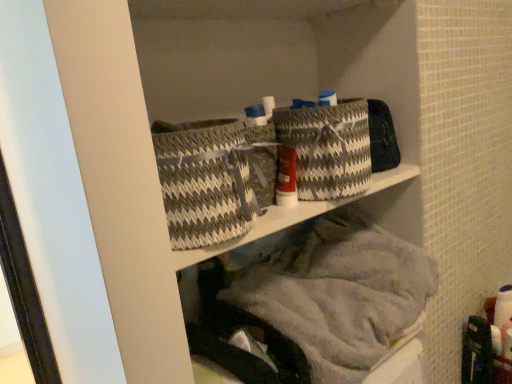
Describe the element at coordinates (337, 291) in the screenshot. Image resolution: width=512 pixels, height=384 pixels. I see `gray woven baskets at upper center` at that location.

In order to face gray and white woven basket at center, which is the first basket from right to left, should I rotate leftwards or rightwards?

You should look right and rotate roughly 9.445 degrees.

The height and width of the screenshot is (384, 512). Describe the element at coordinates (205, 181) in the screenshot. I see `gray woven basket at center, the second basket positioned from the right` at that location.

Where is `gray woven baskets at upper center`? This screenshot has height=384, width=512. gray woven baskets at upper center is located at coordinates (337, 291).

Where is `toiletry that appears above the gray woven baskets at upper center (from the image's perspective)`? toiletry that appears above the gray woven baskets at upper center (from the image's perspective) is located at coordinates (x=286, y=177).

Is gray woven baskets at upper center positioned beyond the bounds of white plastic can at center?

Absolutely, gray woven baskets at upper center is external to white plastic can at center.

Is gray woven baskets at upper center far away from gray woven basket at center, the first basket positioned from the left?

No, there isn't a large distance between gray woven baskets at upper center and gray woven basket at center, the first basket positioned from the left.

Is gray woven baskets at upper center shorter than gray woven basket at center, the second basket positioned from the right?

No.

Considering the relative sizes of gray woven baskets at upper center and gray woven basket at center, the second basket positioned from the right, in the image provided, is gray woven baskets at upper center bigger than gray woven basket at center, the second basket positioned from the right,?

Correct, gray woven baskets at upper center is larger in size than gray woven basket at center, the second basket positioned from the right.

Which is behind, point (298, 258) or point (188, 147)?

Point (298, 258)

In the scene shown: Could you tell me if white plastic can at center is facing gray woven basket at center, the second basket positioned from the right?

No, white plastic can at center is not turned towards gray woven basket at center, the second basket positioned from the right.

Is white plastic can at center wider or thinner than gray woven basket at center, the first basket positioned from the left?

In the image, white plastic can at center appears to be more narrow than gray woven basket at center, the first basket positioned from the left.

Is white plastic can at center shorter than gray woven basket at center, the first basket positioned from the left?

Yes.

Who is smaller, white plastic can at center or gray woven basket at center, the second basket positioned from the right?

Smaller between the two is white plastic can at center.

Considering the positions of objects white plastic can at center and gray woven baskets at upper center in the image provided, who is more to the right, white plastic can at center or gray woven baskets at upper center?

gray woven baskets at upper center is more to the right.

This screenshot has height=384, width=512. Find the location of `material on the right of the white plastic can at center`. material on the right of the white plastic can at center is located at coordinates (337, 291).

Considering the points (281, 189) and (379, 357), which point is behind, point (281, 189) or point (379, 357)?

Positioned behind is point (379, 357).

Considering the points (190, 122) and (285, 172), which point is behind, point (190, 122) or point (285, 172)?

The point (190, 122) is farther from the camera.

Is gray woven basket at center, the second basket positioned from the right, beside white plastic can at center?

gray woven basket at center, the second basket positioned from the right, and white plastic can at center are not in contact.

From a real-world perspective, is gray woven basket at center, the first basket positioned from the left, positioned above or below white plastic can at center?

In terms of real-world spatial position, gray woven basket at center, the first basket positioned from the left, is above white plastic can at center.

Can we say gray woven basket at center, the second basket positioned from the right, lies outside white plastic can at center?

Yes, gray woven basket at center, the second basket positioned from the right, is located beyond the bounds of white plastic can at center.

Is point (287, 190) closer to viewer compared to point (315, 174)?

No, it is not.

Is white plastic can at center directly adjacent to gray and white woven basket at center, which ranks as the second basket in left-to-right order?

Yes.

Would you say white plastic can at center is inside or outside gray and white woven basket at center, which is the first basket from right to left?

white plastic can at center exists outside the volume of gray and white woven basket at center, which is the first basket from right to left.

How many degrees apart are the facing directions of white plastic can at center and gray and white woven basket at center, which ranks as the second basket in left-to-right order?

0.000858 degrees.

From the picture: Who is shorter, gray woven basket at center, the first basket positioned from the left, or gray and white woven basket at center, which ranks as the second basket in left-to-right order?

gray woven basket at center, the first basket positioned from the left.

Is gray woven basket at center, the first basket positioned from the left, looking in the opposite direction of gray and white woven basket at center, which ranks as the second basket in left-to-right order?

No, gray and white woven basket at center, which ranks as the second basket in left-to-right order, is not at the back of gray woven basket at center, the first basket positioned from the left.

Considering the relative positions of gray woven basket at center, the second basket positioned from the right, and gray and white woven basket at center, which ranks as the second basket in left-to-right order, in the image provided, is gray woven basket at center, the second basket positioned from the right, to the left of gray and white woven basket at center, which ranks as the second basket in left-to-right order, from the viewer's perspective?

Yes, gray woven basket at center, the second basket positioned from the right, is to the left of gray and white woven basket at center, which ranks as the second basket in left-to-right order.

Does gray woven basket at center, the second basket positioned from the right, contain gray and white woven basket at center, which ranks as the second basket in left-to-right order?

No, gray and white woven basket at center, which ranks as the second basket in left-to-right order, is not inside gray woven basket at center, the second basket positioned from the right.

You are a GUI agent. You are given a task and a screenshot of the screen. Output one action in this format:
    pyautogui.click(x=<x>, y=<y>)
    Task: Click on the material to the right of white plastic can at center
    The width and height of the screenshot is (512, 384).
    Given the screenshot: What is the action you would take?
    pyautogui.click(x=337, y=291)

This screenshot has height=384, width=512. What are the coordinates of `material below the gray woven basket at center, the second basket positioned from the right (from a real-world perspective)` in the screenshot? It's located at [337, 291].

Which object lies further to the anchor point white plastic can at center, gray and white woven basket at center, which is the first basket from right to left, or gray woven baskets at upper center?

gray woven baskets at upper center lies further to white plastic can at center than the other object.

Which object lies nearer to the anchor point gray and white woven basket at center, which is the first basket from right to left, gray woven baskets at upper center or white plastic can at center?

The object closer to gray and white woven basket at center, which is the first basket from right to left, is white plastic can at center.

Consider the image. From the image, which object appears to be farther from gray woven baskets at upper center, white plastic can at center or gray and white woven basket at center, which is the first basket from right to left?

white plastic can at center is positioned further to the anchor gray woven baskets at upper center.

Looking at the image, which one is located further to gray and white woven basket at center, which is the first basket from right to left, gray woven basket at center, the second basket positioned from the right, or white plastic can at center?

gray woven basket at center, the second basket positioned from the right, is positioned further to the anchor gray and white woven basket at center, which is the first basket from right to left.

Which object lies further to the anchor point gray woven basket at center, the second basket positioned from the right, white plastic can at center or gray woven baskets at upper center?

The object further to gray woven basket at center, the second basket positioned from the right, is gray woven baskets at upper center.

From the image, which object appears to be nearer to gray woven basket at center, the first basket positioned from the left, gray and white woven basket at center, which is the first basket from right to left, or gray woven baskets at upper center?

Based on the image, gray and white woven basket at center, which is the first basket from right to left, appears to be nearer to gray woven basket at center, the first basket positioned from the left.

Which object lies further to the anchor point white plastic can at center, gray woven basket at center, the first basket positioned from the left, or gray and white woven basket at center, which is the first basket from right to left?

Based on the image, gray woven basket at center, the first basket positioned from the left, appears to be further to white plastic can at center.

Estimate the real-world distances between objects in this image. Which object is closer to gray woven baskets at upper center, gray woven basket at center, the second basket positioned from the right, or gray and white woven basket at center, which is the first basket from right to left?

gray and white woven basket at center, which is the first basket from right to left.

Locate an element on the screen. This screenshot has height=384, width=512. basket between white plastic can at center and gray woven baskets at upper center from top to bottom is located at coordinates (205, 181).

At what (x,y) coordinates should I click in order to perform the action: click on basket between gray and white woven basket at center, which is the first basket from right to left, and gray woven baskets at upper center in the up-down direction. Please return your answer as a coordinate pair (x, y). This screenshot has height=384, width=512. Looking at the image, I should click on (205, 181).

You are a GUI agent. You are given a task and a screenshot of the screen. Output one action in this format:
    pyautogui.click(x=<x>, y=<y>)
    Task: Click on the toiletry that lies between gray and white woven basket at center, which is the first basket from right to left, and gray woven baskets at upper center from top to bottom
    
    Given the screenshot: What is the action you would take?
    pyautogui.click(x=286, y=177)

Locate an element on the screen. toiletry between gray woven basket at center, the first basket positioned from the left, and gray and white woven basket at center, which is the first basket from right to left, from left to right is located at coordinates (286, 177).